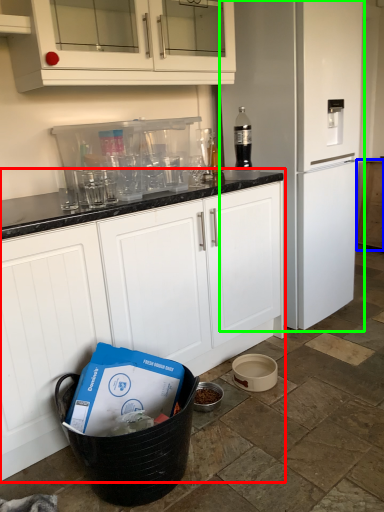
Question: Based on their relative distances, which object is nearer to cabinetry (highlighted by a red box)? Choose from cabinetry (highlighted by a blue box) and home appliance (highlighted by a green box).

Choices:
 (A) cabinetry
 (B) home appliance

Answer: (B)